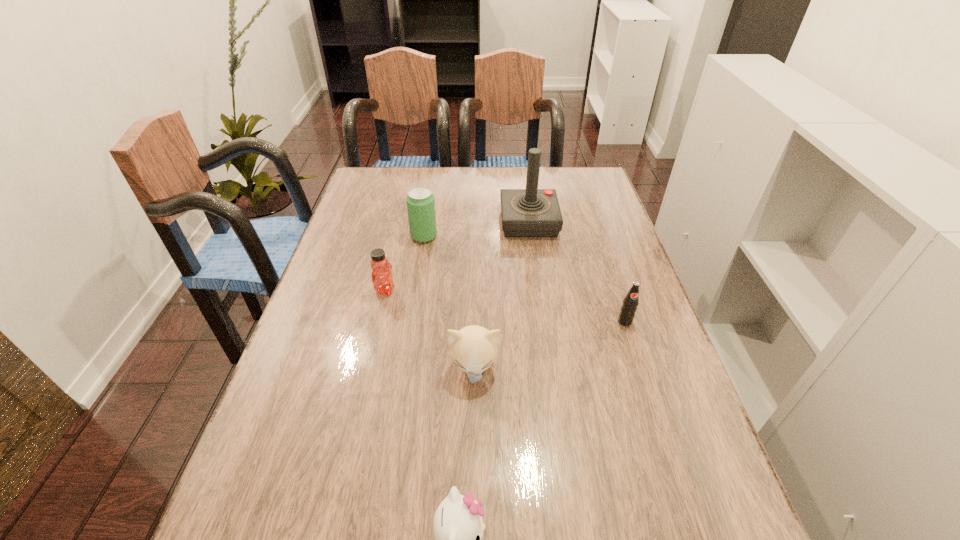
Find the location of `free space at the right edge of the desktop`. free space at the right edge of the desktop is located at coordinates (623, 396).

The image size is (960, 540). I want to click on free space at the far right corner, so click(593, 171).

Find the location of a particular element. This screenshot has height=540, width=960. free space between the farther pop and the fifth object from left to right is located at coordinates (476, 229).

Where is `vacant area that lies between the leftmost object and the tallest object`? vacant area that lies between the leftmost object and the tallest object is located at coordinates [x=457, y=256].

Locate an element on the screen. This screenshot has width=960, height=540. vacant region between the nearer pop and the farther pop is located at coordinates (524, 279).

Identify the location of empty space between the tallest object and the nearer pop. This screenshot has height=540, width=960. (577, 272).

Locate an element on the screen. vacant space that's between the nearer pop and the farther pop is located at coordinates (524, 279).

Where is `vacant space in between the nearer pop and the second nearest object`? vacant space in between the nearer pop and the second nearest object is located at coordinates (549, 345).

Image resolution: width=960 pixels, height=540 pixels. I want to click on free space that is in between the farther pop and the farther kitten, so click(x=449, y=302).

You are a GUI agent. You are given a task and a screenshot of the screen. Output one action in this format:
    pyautogui.click(x=<x>, y=<y>)
    Task: Click on the vacant area that lies between the fifth farthest object and the left pop
    
    Given the screenshot: What is the action you would take?
    pyautogui.click(x=449, y=302)